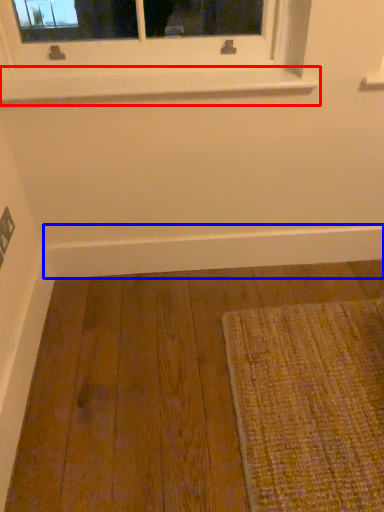
Question: Which object is closer to the camera taking this photo, window sill (highlighted by a red box) or molding (highlighted by a blue box)?

Choices:
 (A) window sill
 (B) molding

Answer: (A)